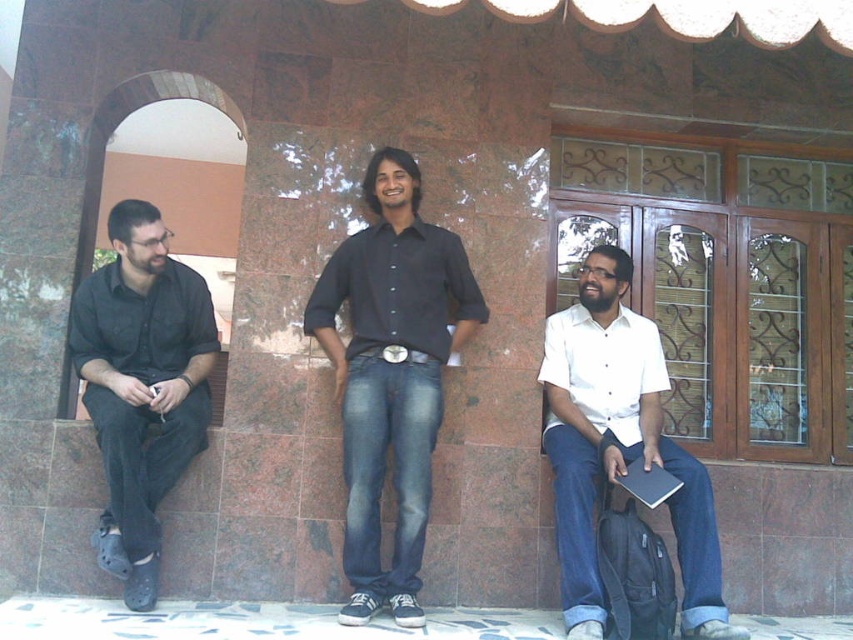
Question: Which object is positioned closest to the black matte shirt at left?

Choices:
 (A) black denim jeans at center
 (B) white matte shirt at center

Answer: (A)

Question: From the image, what is the correct spatial relationship of black denim jeans at center in relation to black matte shirt at left?

Choices:
 (A) above
 (B) below

Answer: (A)

Question: Considering the real-world distances, which object is closest to the black matte shirt at left?

Choices:
 (A) white matte shirt at center
 (B) black denim jeans at center

Answer: (B)

Question: In this image, where is white matte shirt at center located relative to black matte shirt at left?

Choices:
 (A) right
 (B) left

Answer: (A)

Question: Where is white matte shirt at center located in relation to black matte shirt at left in the image?

Choices:
 (A) left
 (B) right

Answer: (B)

Question: Which point is closer to the camera?

Choices:
 (A) (154, 582)
 (B) (587, 630)

Answer: (B)